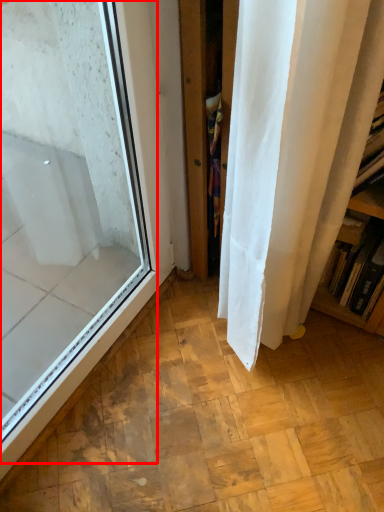
Question: From the image's perspective, considering the relative positions of window (annotated by the red box) and bookshelf in the image provided, where is window (annotated by the red box) located with respect to the staircase?

Choices:
 (A) above
 (B) below

Answer: (B)